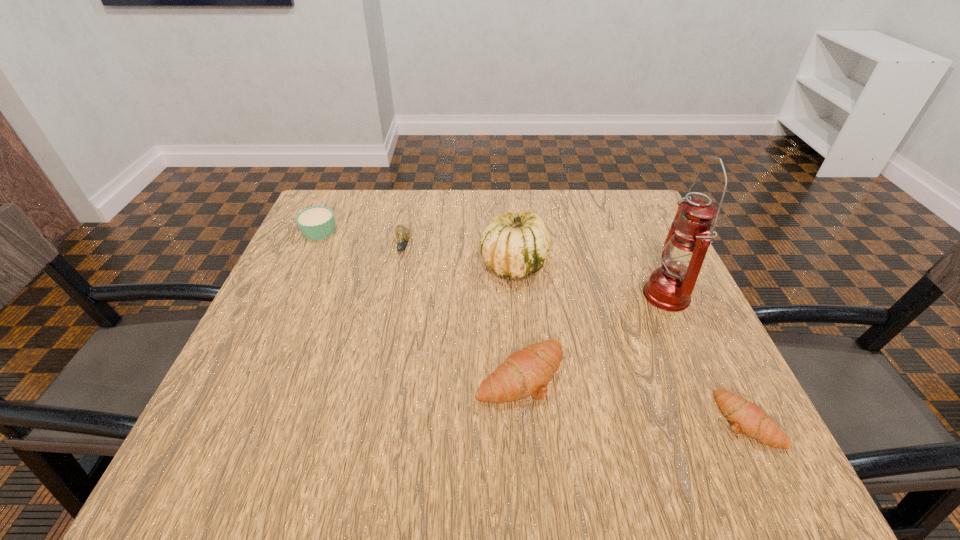
Find the location of a particular element. free space that satisfies the following two spatial constraints: 1. on the back side of the left crescent roll; 2. on the right side of the oil lamp is located at coordinates (514, 294).

In order to click on free space in the image that satisfies the following two spatial constraints: 1. on the front-facing side of the tallest object; 2. on the left side of the fifth object from right to left in this screenshot , I will do `click(393, 294)`.